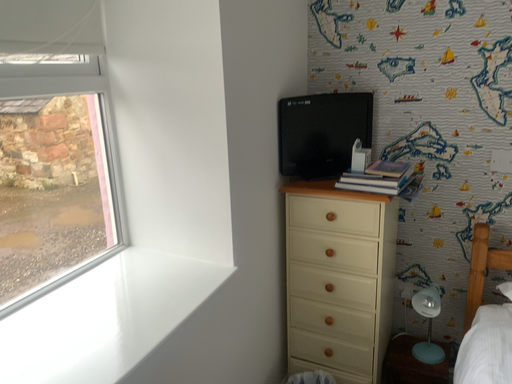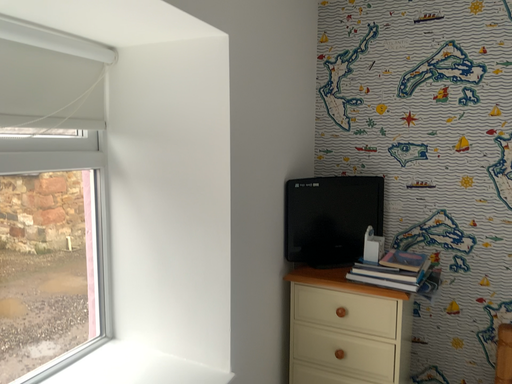
Question: How did the camera likely rotate when shooting the video?

Choices:
 (A) rotated downward
 (B) rotated upward

Answer: (B)